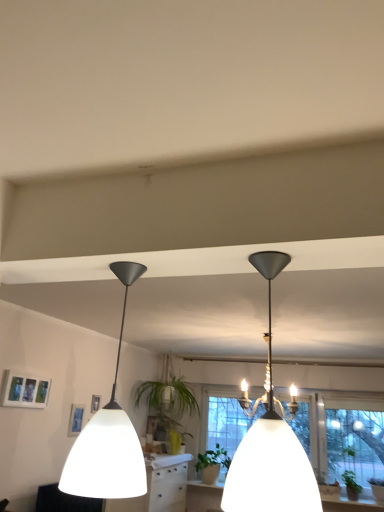
Question: Does matte black chandelier at upper center, the 2th lamp in the left-to-right sequence, have a lesser height compared to green matte plant at center, arranged as the first plant when viewed from the left?

Choices:
 (A) yes
 (B) no

Answer: (B)

Question: From the image's perspective, is matte black chandelier at upper center, the 1th lamp positioned from the right, located above green matte plant at center, the 2th plant from the right?

Choices:
 (A) yes
 (B) no

Answer: (A)

Question: Can you confirm if matte black chandelier at upper center, the 2th lamp in the left-to-right sequence, is bigger than green matte plant at center, the 2th plant from the right?

Choices:
 (A) yes
 (B) no

Answer: (A)

Question: Is matte black chandelier at upper center, the 2th lamp in the left-to-right sequence, positioned before green matte plant at center, the 2th plant from the right?

Choices:
 (A) no
 (B) yes

Answer: (B)

Question: Considering the relative sizes of matte black chandelier at upper center, the 2th lamp in the left-to-right sequence, and green matte plant at center, arranged as the first plant when viewed from the back, in the image provided, is matte black chandelier at upper center, the 2th lamp in the left-to-right sequence, smaller than green matte plant at center, arranged as the first plant when viewed from the back,?

Choices:
 (A) no
 (B) yes

Answer: (A)

Question: Is matte black chandelier at upper center, the 1th lamp positioned from the right, next to green matte plant at center, arranged as the first plant when viewed from the back, and touching it?

Choices:
 (A) no
 (B) yes

Answer: (A)

Question: Is matte white picture frame at upper left behind transparent glass window at center?

Choices:
 (A) yes
 (B) no

Answer: (B)

Question: Can you confirm if matte white picture frame at upper left is wider than transparent glass window at center?

Choices:
 (A) yes
 (B) no

Answer: (B)

Question: Is there a large distance between matte white picture frame at upper left and transparent glass window at center?

Choices:
 (A) yes
 (B) no

Answer: (A)

Question: Can you confirm if matte white picture frame at upper left is bigger than transparent glass window at center?

Choices:
 (A) no
 (B) yes

Answer: (A)

Question: Can we say matte white picture frame at upper left lies outside transparent glass window at center?

Choices:
 (A) no
 (B) yes

Answer: (B)

Question: Is matte white picture frame at upper left in front of transparent glass window at center?

Choices:
 (A) yes
 (B) no

Answer: (A)

Question: Is green matte plant at center, arranged as the first plant when viewed from the left, positioned with its back to matte black lampshade at left, the 2th lamp in the right-to-left sequence?

Choices:
 (A) no
 (B) yes

Answer: (A)